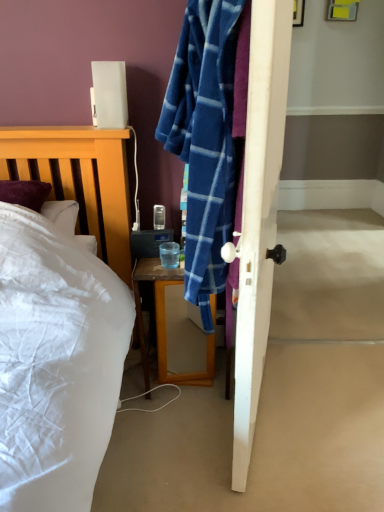
You are a GUI agent. You are given a task and a screenshot of the screen. Output one action in this format:
    pyautogui.click(x=<x>, y=<y>)
    Task: Click on the satin white lamp at upper left
    This screenshot has height=512, width=384.
    Given the screenshot: What is the action you would take?
    point(110,94)

I want to click on yellow plastic picture frame at upper right, so click(x=342, y=10).

The image size is (384, 512). I want to click on satin white lamp at upper left, so click(x=110, y=94).

What are the coordinates of `lamp positioned vertically above the wooden desk at center (from a real-world perspective)` in the screenshot? It's located at (110, 94).

Does satin white lamp at upper left have a lesser height compared to wooden desk at center?

Yes, satin white lamp at upper left is shorter than wooden desk at center.

Does satin white lamp at upper left turn towards wooden desk at center?

No, satin white lamp at upper left is not aimed at wooden desk at center.

Considering the sizes of satin white lamp at upper left and wooden desk at center in the image, is satin white lamp at upper left wider or thinner than wooden desk at center?

Considering their sizes, satin white lamp at upper left looks slimmer than wooden desk at center.

Could you tell me if wooden desk at center is turned towards satin white lamp at upper left?

No.

Which object is positioned more to the left, wooden desk at center or satin white lamp at upper left?

satin white lamp at upper left.

Does wooden desk at center have a lesser height compared to satin white lamp at upper left?

No.

Is satin white lamp at upper left located within wooden desk at center?

No, satin white lamp at upper left is not a part of wooden desk at center.

Looking at their sizes, would you say satin white lamp at upper left is wider or thinner than yellow plastic picture frame at upper right?

Considering their sizes, satin white lamp at upper left looks broader than yellow plastic picture frame at upper right.

The width and height of the screenshot is (384, 512). I want to click on lamp that appears below the yellow plastic picture frame at upper right (from a real-world perspective), so click(x=110, y=94).

In the scene shown: Considering the sizes of objects satin white lamp at upper left and yellow plastic picture frame at upper right in the image provided, who is shorter, satin white lamp at upper left or yellow plastic picture frame at upper right?

satin white lamp at upper left.

How many degrees apart are the facing directions of satin white lamp at upper left and yellow plastic picture frame at upper right?

The facing directions of satin white lamp at upper left and yellow plastic picture frame at upper right are 4.95 degrees apart.

Who is shorter, satin white lamp at upper left or transparent glass at bedside?

With less height is transparent glass at bedside.

Which of these two, satin white lamp at upper left or transparent glass at bedside, is smaller?

transparent glass at bedside is smaller.

Does satin white lamp at upper left appear on the left side of transparent glass at bedside?

Indeed, satin white lamp at upper left is positioned on the left side of transparent glass at bedside.

Is satin white lamp at upper left with transparent glass at bedside?

satin white lamp at upper left and transparent glass at bedside are not in contact.

Would you say yellow plastic picture frame at upper right is part of wooden desk at center's contents?

No, yellow plastic picture frame at upper right is not inside wooden desk at center.

Which object is more forward, wooden desk at center or yellow plastic picture frame at upper right?

wooden desk at center is in front.

Identify the location of desk on the left of the yellow plastic picture frame at upper right. This screenshot has width=384, height=512. (165, 325).

Are wooden desk at center and yellow plastic picture frame at upper right beside each other?

wooden desk at center and yellow plastic picture frame at upper right are clearly separated.

From a real-world perspective, is transparent glass at bedside physically located above or below yellow plastic picture frame at upper right?

transparent glass at bedside is below yellow plastic picture frame at upper right.

What's the angular difference between transparent glass at bedside and yellow plastic picture frame at upper right's facing directions?

They differ by 3.23 degrees in their facing directions.

This screenshot has width=384, height=512. I want to click on coffee cup below the yellow plastic picture frame at upper right (from the image's perspective), so click(169, 254).

Visually, is transparent glass at bedside positioned to the left or to the right of yellow plastic picture frame at upper right?

Based on their positions, transparent glass at bedside is located to the left of yellow plastic picture frame at upper right.

Which object is further away from the camera taking this photo, yellow plastic picture frame at upper right or satin white lamp at upper left?

yellow plastic picture frame at upper right is behind.

From a real-world perspective, which is physically below, yellow plastic picture frame at upper right or satin white lamp at upper left?

satin white lamp at upper left is physically lower.

Is yellow plastic picture frame at upper right taller or shorter than satin white lamp at upper left?

yellow plastic picture frame at upper right is taller than satin white lamp at upper left.

The height and width of the screenshot is (512, 384). I want to click on desk that appears below the satin white lamp at upper left (from the image's perspective), so 165,325.

In the image, there is a satin white lamp at upper left. Find the location of `desk below it (from a real-world perspective)`. desk below it (from a real-world perspective) is located at coordinates (165, 325).

Which object lies further to the anchor point wooden desk at center, satin white lamp at upper left or yellow plastic picture frame at upper right?

yellow plastic picture frame at upper right is further to wooden desk at center.

Looking at the image, which one is located closer to wooden desk at center, transparent glass at bedside or satin white lamp at upper left?

Among the two, transparent glass at bedside is located nearer to wooden desk at center.

From the image, which object appears to be farther from yellow plastic picture frame at upper right, satin white lamp at upper left or transparent glass at bedside?

Among the two, transparent glass at bedside is located further to yellow plastic picture frame at upper right.

Looking at the image, which one is located closer to yellow plastic picture frame at upper right, wooden desk at center or satin white lamp at upper left?

satin white lamp at upper left lies closer to yellow plastic picture frame at upper right than the other object.

In the scene shown: Estimate the real-world distances between objects in this image. Which object is further from transparent glass at bedside, wooden desk at center or satin white lamp at upper left?

Based on the image, satin white lamp at upper left appears to be further to transparent glass at bedside.

Looking at this image, which object lies further to the anchor point yellow plastic picture frame at upper right, transparent glass at bedside or wooden desk at center?

wooden desk at center.

Considering their positions, is yellow plastic picture frame at upper right positioned closer to transparent glass at bedside than wooden desk at center?

wooden desk at center is closer to transparent glass at bedside.

Considering their positions, is satin white lamp at upper left positioned further to wooden desk at center than transparent glass at bedside?

satin white lamp at upper left is positioned further to the anchor wooden desk at center.

In order to click on lamp between yellow plastic picture frame at upper right and wooden desk at center in the up-down direction in this screenshot , I will do `click(110, 94)`.

Where is `coffee cup between satin white lamp at upper left and wooden desk at center vertically`? The width and height of the screenshot is (384, 512). coffee cup between satin white lamp at upper left and wooden desk at center vertically is located at coordinates (169, 254).

Where is `lamp between yellow plastic picture frame at upper right and transparent glass at bedside in the vertical direction`? This screenshot has height=512, width=384. lamp between yellow plastic picture frame at upper right and transparent glass at bedside in the vertical direction is located at coordinates (110, 94).

I want to click on coffee cup between yellow plastic picture frame at upper right and wooden desk at center in the vertical direction, so click(x=169, y=254).